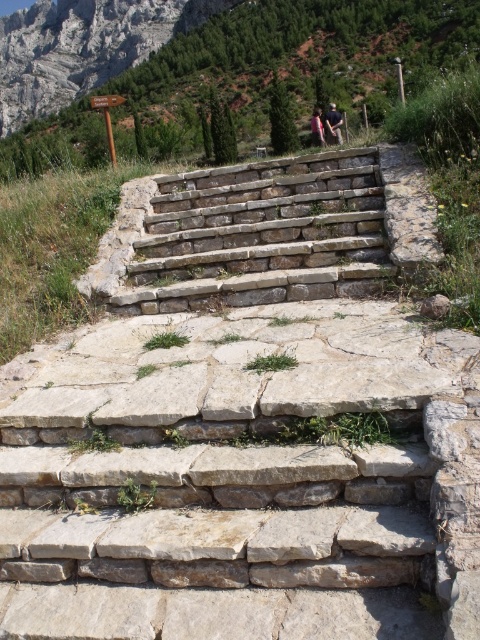
Consider the image. You are standing at the base of the stone staircase and see the natural stone stairs at center and the dark blue shirt at center. Which object is closer to you?

The natural stone stairs at center is closer to you because it is in front of the dark blue shirt at center.

You are a hiker standing at the base of the stone staircase. You notice a dark blue shirt at center and a pink fabric at center. Which item is closer to the ground?

The dark blue shirt at center is positioned under the pink fabric at center, so it is closer to the ground.

You are a hiker standing at the base of the stone staircase and notice a dark blue shirt at center and a pink fabric at center. Which clothing item appears narrower?

The dark blue shirt at center has a lesser width compared to the pink fabric at center, so the dark blue shirt at center appears narrower.